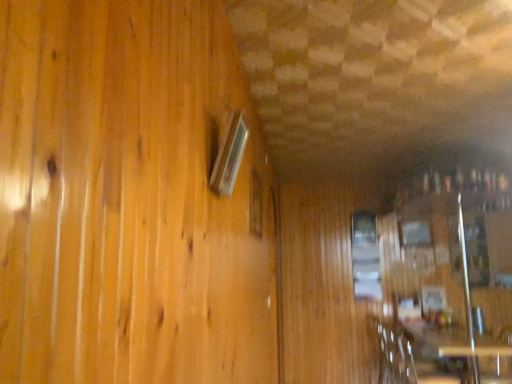
Question: Is the surface of wooden armchair at lower right in direct contact with transparent glass table at lower right, marked as the first table in a back-to-front arrangement?

Choices:
 (A) no
 (B) yes

Answer: (A)

Question: Does wooden armchair at lower right contain transparent glass table at lower right, marked as the first table in a back-to-front arrangement?

Choices:
 (A) yes
 (B) no

Answer: (B)

Question: Is wooden armchair at lower right turned away from transparent glass table at lower right, the second table positioned from the front?

Choices:
 (A) yes
 (B) no

Answer: (B)

Question: Is the position of wooden armchair at lower right less distant than that of transparent glass table at lower right, the second table positioned from the front?

Choices:
 (A) yes
 (B) no

Answer: (B)

Question: Is wooden armchair at lower right smaller than transparent glass table at lower right, the second table positioned from the front?

Choices:
 (A) no
 (B) yes

Answer: (A)

Question: From the image's perspective, is matte glass window at upper left, which is counted as the first window, starting from the front, above or below clear glass window at upper center, positioned as the second window in left-to-right order?

Choices:
 (A) above
 (B) below

Answer: (A)

Question: Is matte glass window at upper left, which is counted as the first window, starting from the front, inside or outside of clear glass window at upper center, which appears as the 2th window when viewed from the right?

Choices:
 (A) outside
 (B) inside

Answer: (A)

Question: Considering the relative positions of matte glass window at upper left, positioned as the third window in right-to-left order, and clear glass window at upper center, the 2th window in the front-to-back sequence, in the image provided, is matte glass window at upper left, positioned as the third window in right-to-left order, to the left or to the right of clear glass window at upper center, the 2th window in the front-to-back sequence,?

Choices:
 (A) left
 (B) right

Answer: (A)

Question: From a real-world perspective, is matte glass window at upper left, which is counted as the third window, starting from the back, above or below clear glass window at upper center, positioned as the second window in left-to-right order?

Choices:
 (A) below
 (B) above

Answer: (A)

Question: Based on their positions, is wooden table at lower right, marked as the second table in a back-to-front arrangement, located to the left or right of matte glass window at upper left, positioned as the third window in right-to-left order?

Choices:
 (A) right
 (B) left

Answer: (A)

Question: Is wooden table at lower right, which is the first table in front-to-back order, wider or thinner than matte glass window at upper left, which is counted as the third window, starting from the back?

Choices:
 (A) wide
 (B) thin

Answer: (A)

Question: Considering the positions of wooden table at lower right, marked as the second table in a back-to-front arrangement, and matte glass window at upper left, which is counted as the third window, starting from the back, in the image, is wooden table at lower right, marked as the second table in a back-to-front arrangement, taller or shorter than matte glass window at upper left, which is counted as the third window, starting from the back,?

Choices:
 (A) tall
 (B) short

Answer: (A)

Question: In terms of size, does wooden table at lower right, which is the first table in front-to-back order, appear bigger or smaller than matte glass window at upper left, which is counted as the third window, starting from the back?

Choices:
 (A) big
 (B) small

Answer: (A)

Question: Is point (434, 352) closer or farther from the camera than point (250, 196)?

Choices:
 (A) farther
 (B) closer

Answer: (A)

Question: Based on their positions, is wooden table at lower right, which is the first table in front-to-back order, located to the left or right of clear glass window at upper center, which is counted as the 2th window, starting from the back?

Choices:
 (A) right
 (B) left

Answer: (A)